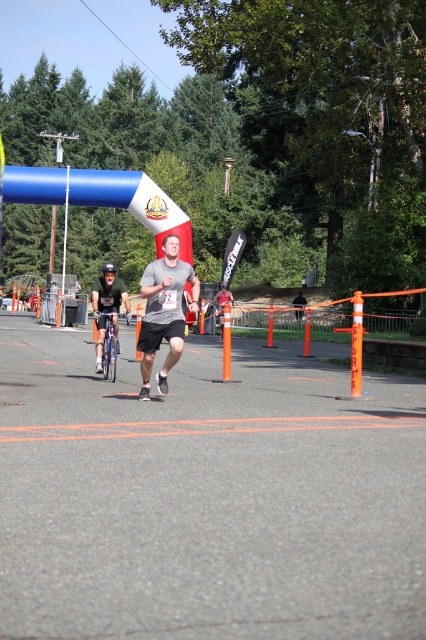
Does gray matte shirt at center have a lesser width compared to green matte shirt at center?

Correct, gray matte shirt at center's width is less than green matte shirt at center's.

Is gray matte shirt at center to the right of green matte shirt at center from the viewer's perspective?

Yes, gray matte shirt at center is to the right of green matte shirt at center.

The image size is (426, 640). In order to click on gray matte shirt at center in this screenshot , I will do `click(164, 310)`.